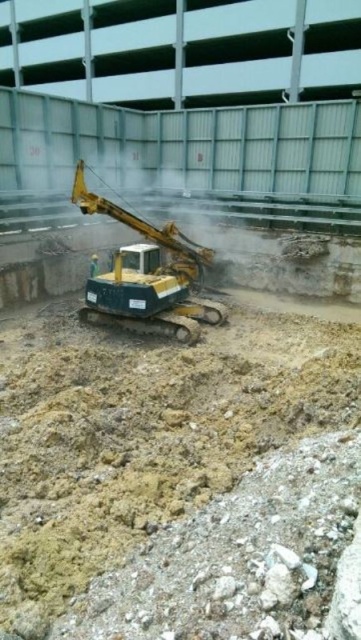
Question: Can you confirm if brown sandy dirt at center is smaller than yellow-green metal excavator at center?

Choices:
 (A) yes
 (B) no

Answer: (B)

Question: Does brown sandy dirt at center appear on the left side of yellow-green metal excavator at center?

Choices:
 (A) no
 (B) yes

Answer: (B)

Question: Is brown sandy dirt at center to the right of yellow-green metal excavator at center from the viewer's perspective?

Choices:
 (A) yes
 (B) no

Answer: (B)